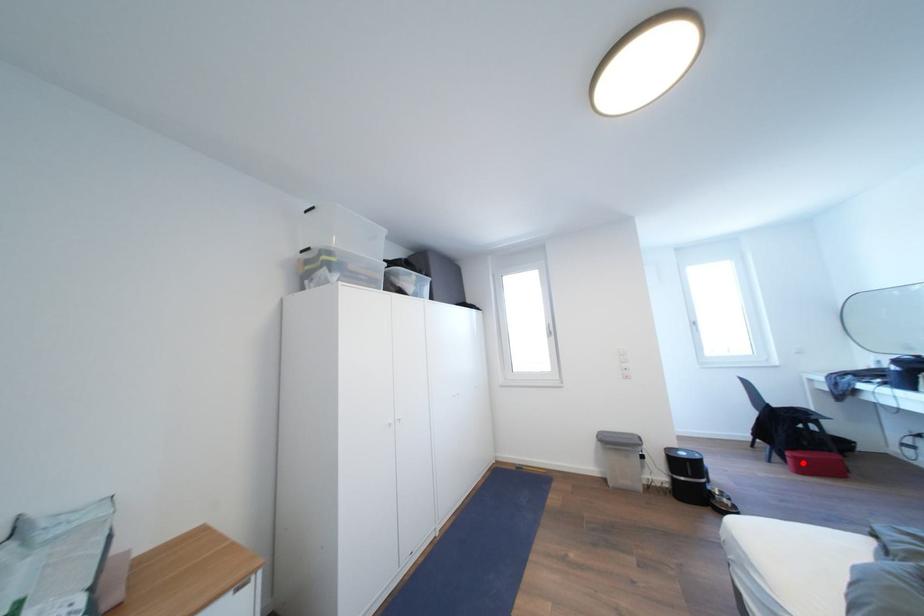
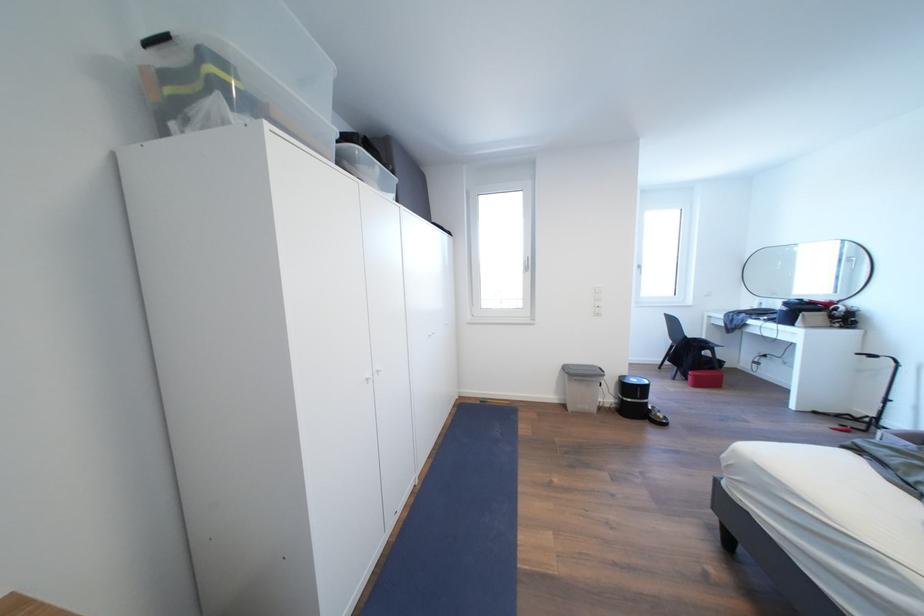
Question: I am providing you with two images of the same scene from different viewpoints. Image1 has a red point marked. In image2, the corresponding 3D location appears at what relative position? Reply with the corresponding letter.

Choices:
 (A) Closer
 (B) Farther

Answer: (A)